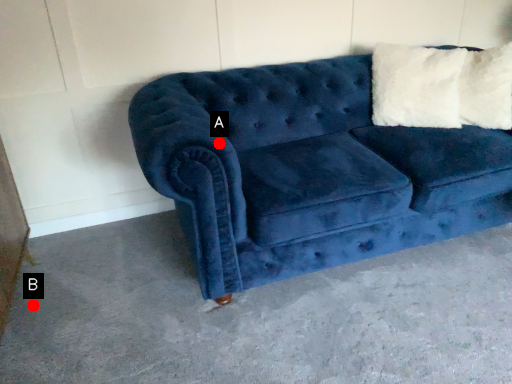
Question: Two points are circled on the image, labeled by A and B beside each circle. Which point is closer to the camera taking this photo?

Choices:
 (A) A is closer
 (B) B is closer

Answer: (A)